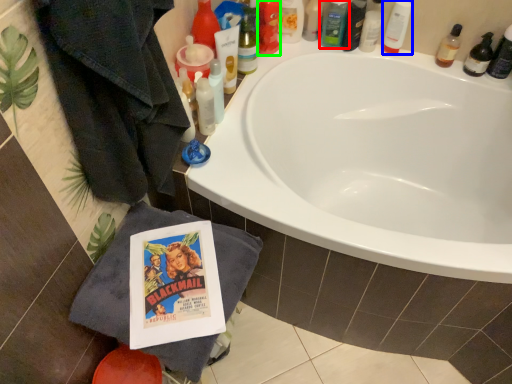
Question: Based on their relative distances, which object is nearer to toiletry (highlighted by a red box)? Choose from toiletry (highlighted by a blue box) and toiletry (highlighted by a green box).

Choices:
 (A) toiletry
 (B) toiletry

Answer: (A)